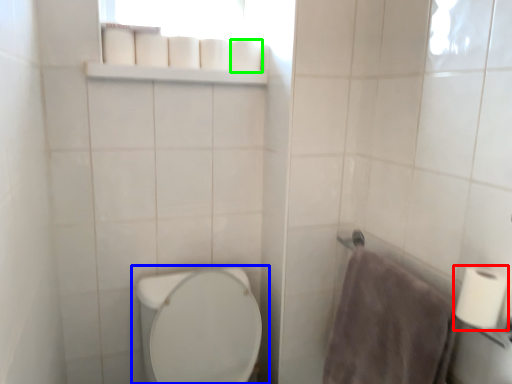
Question: Estimate the real-world distances between objects in this image. Which object is farther from toilet paper (highlighted by a red box), toilet (highlighted by a blue box) or toilet paper (highlighted by a green box)?

Choices:
 (A) toilet
 (B) toilet paper

Answer: (B)